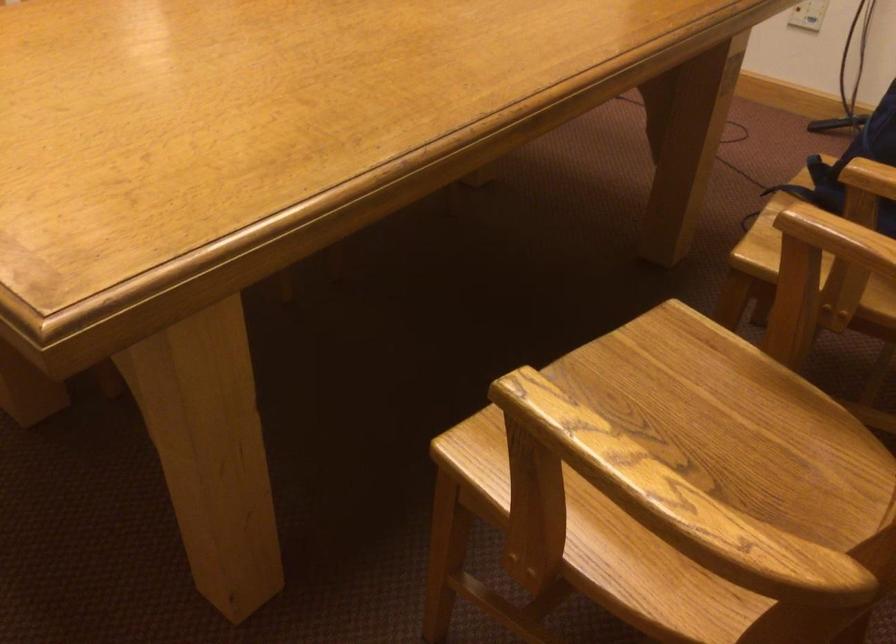
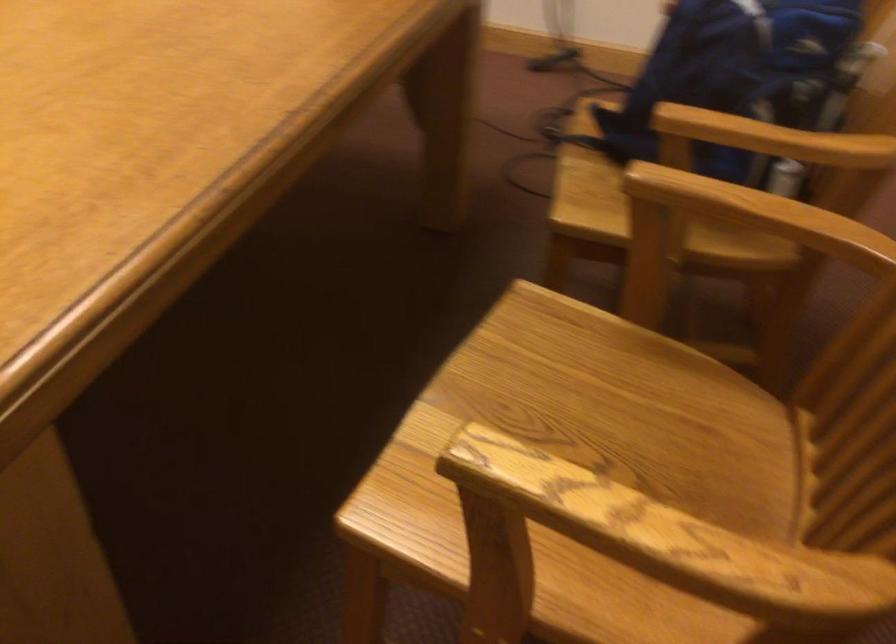
Where in the second image is the point corresponding to point (709, 404) from the first image?

(595, 386)